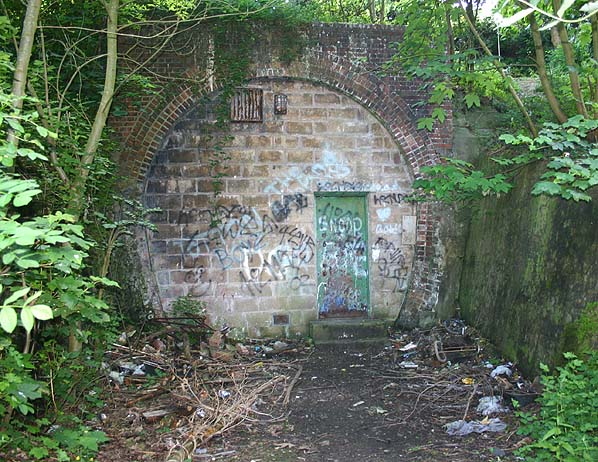
Locate an element on the screen. This screenshot has height=462, width=598. light fixture is located at coordinates (279, 100).